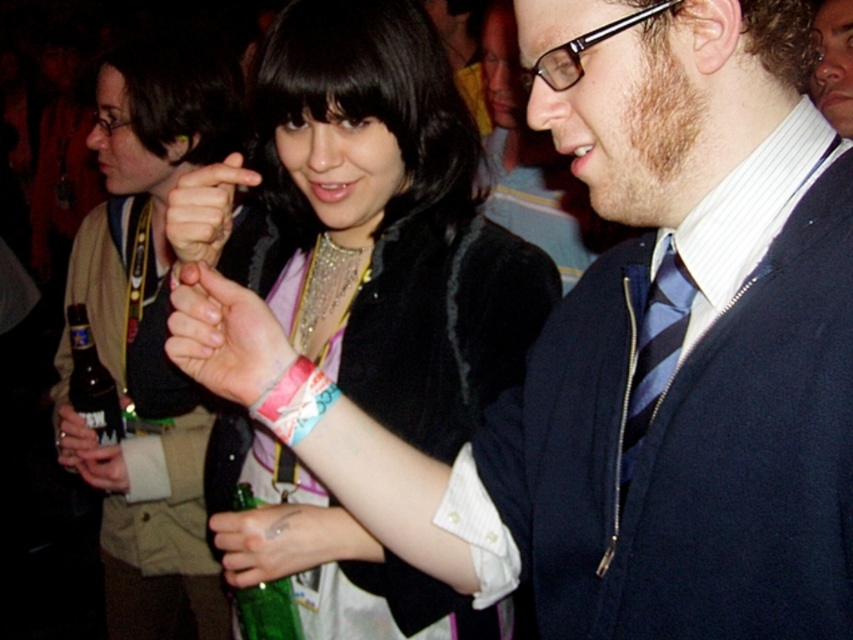
Question: Does pink fabric wristband at center have a greater width compared to green glass bottle at lower left?

Choices:
 (A) no
 (B) yes

Answer: (A)

Question: Estimate the real-world distances between objects in this image. Which object is closer to the matte black wristband at center?

Choices:
 (A) matte black jacket at center
 (B) blue striped tie at center

Answer: (B)

Question: Among these points, which one is nearest to the camera?

Choices:
 (A) (206, 266)
 (B) (222, 237)

Answer: (A)

Question: Does shiny black jacket at center have a lesser width compared to blue striped tie at center?

Choices:
 (A) yes
 (B) no

Answer: (B)

Question: Does shiny black jacket at center have a greater width compared to green glass bottle at lower left?

Choices:
 (A) yes
 (B) no

Answer: (A)

Question: Based on their relative distances, which object is farther from the pink fabric wristband at center?

Choices:
 (A) green glass bottle at lower left
 (B) matte black jacket at center
 (C) blue striped tie at center
 (D) matte black wristband at center

Answer: (B)